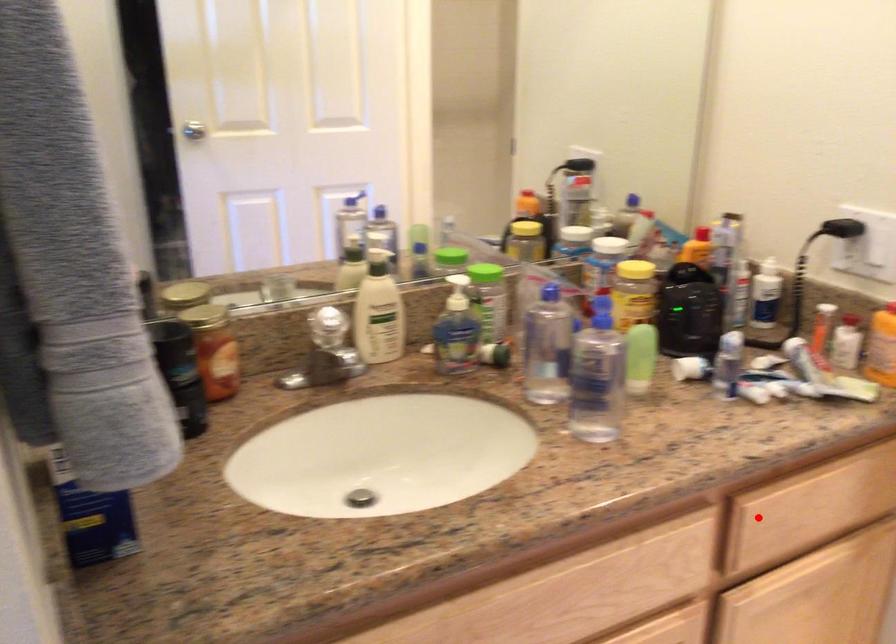
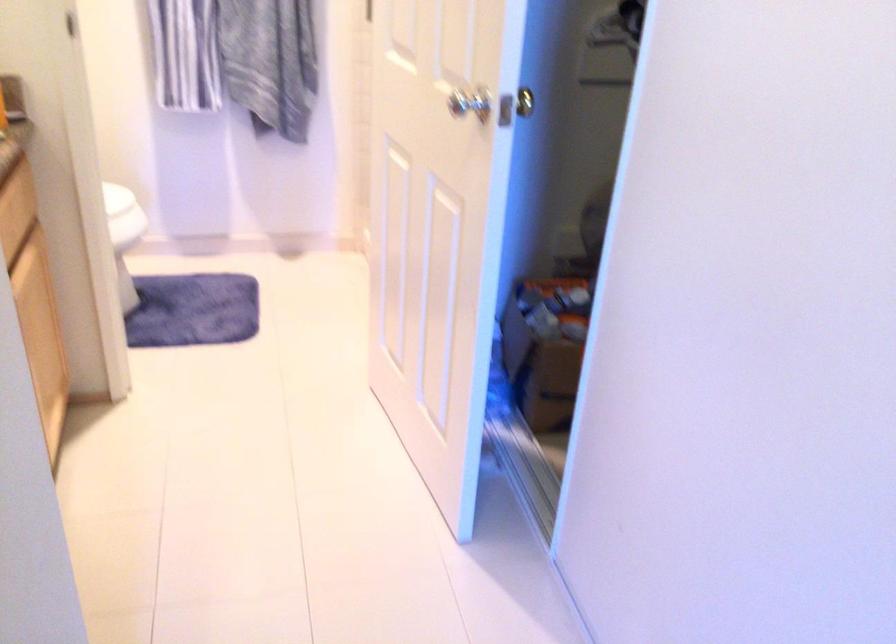
Question: A red point is marked in image1. In image2, is the corresponding 3D point closer to the camera or farther? Reply with the corresponding letter.

Choices:
 (A) The corresponding 3D point is closer.
 (B) The corresponding 3D point is farther.

Answer: (B)